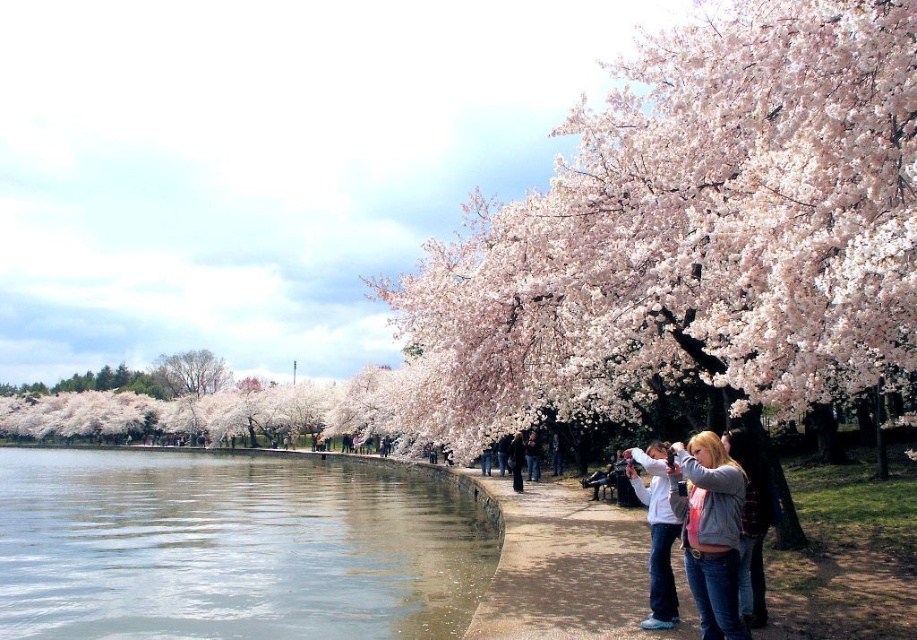
Can you confirm if denim jacket at lower center is thinner than smooth bark tree at left?

Yes.

Between point (725, 448) and point (200, 378), which one is positioned in front?

Point (725, 448) is more forward.

Locate an element on the screen. denim jacket at lower center is located at coordinates (710, 531).

Where is `clear water at lower left`? Image resolution: width=917 pixels, height=640 pixels. clear water at lower left is located at coordinates (231, 548).

Between clear water at lower left and denim jacket at lower center, which one appears on the left side from the viewer's perspective?

From the viewer's perspective, clear water at lower left appears more on the left side.

Measure the distance between point [156,556] and camera.

Point [156,556] and camera are 163.35 feet apart from each other.

Find the location of a particular element. This screenshot has width=917, height=640. clear water at lower left is located at coordinates (231, 548).